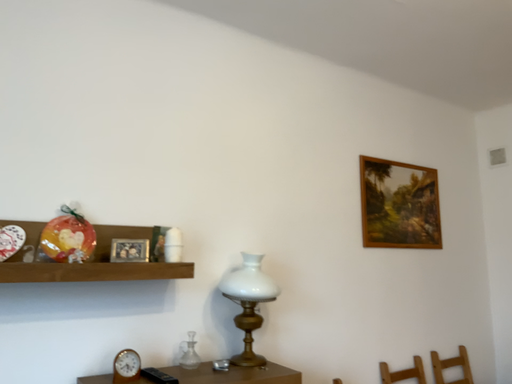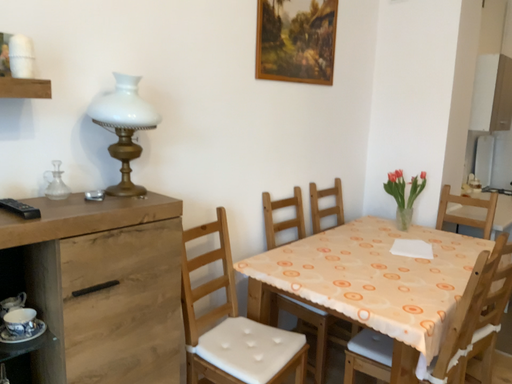
Question: How did the camera likely rotate when shooting the video?

Choices:
 (A) rotated left
 (B) rotated right

Answer: (B)